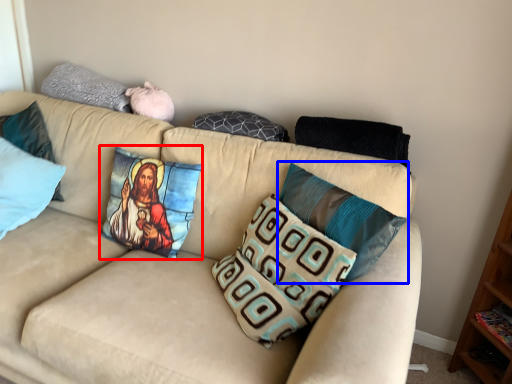
Question: Which object appears closest to the camera in this image, pillow (highlighted by a red box) or pillow (highlighted by a blue box)?

Choices:
 (A) pillow
 (B) pillow

Answer: (B)